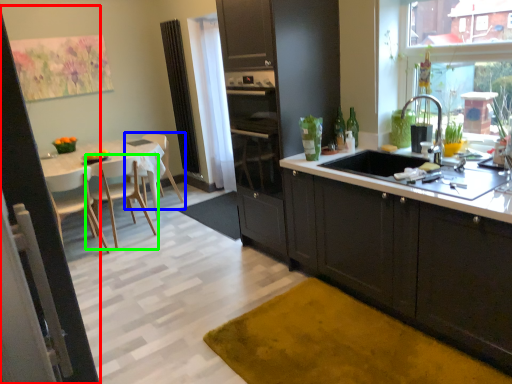
Question: Estimate the real-world distances between objects in this image. Which object is farther from screen door (highlighted by a red box), chair (highlighted by a blue box) or chair (highlighted by a green box)?

Choices:
 (A) chair
 (B) chair

Answer: (A)